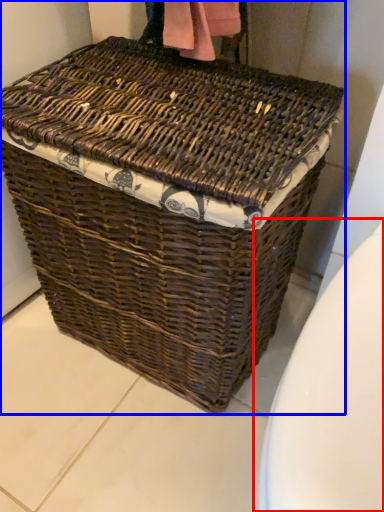
Question: Which point is closer to the camera, toilet bowl (highlighted by a red box) or picnic basket (highlighted by a blue box)?

Choices:
 (A) toilet bowl
 (B) picnic basket

Answer: (A)